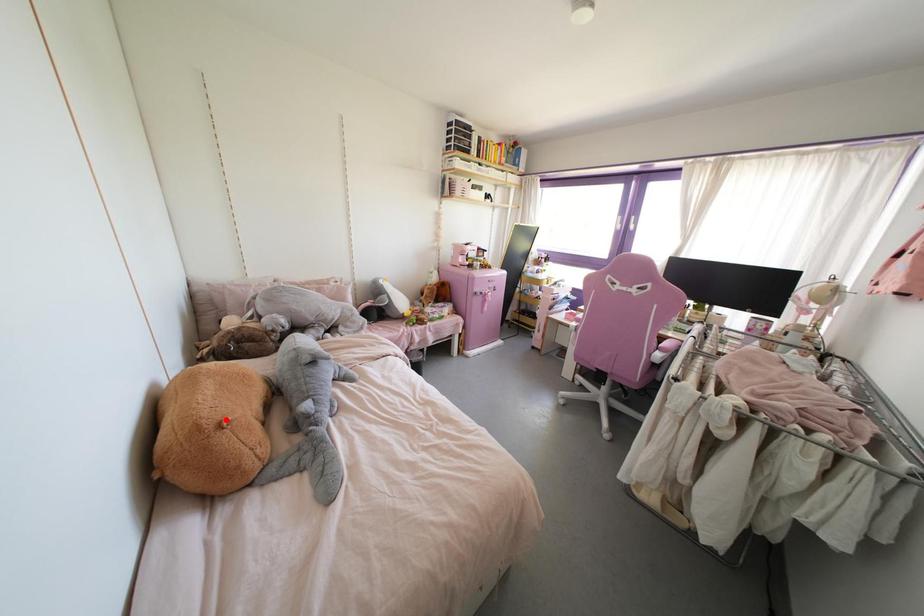
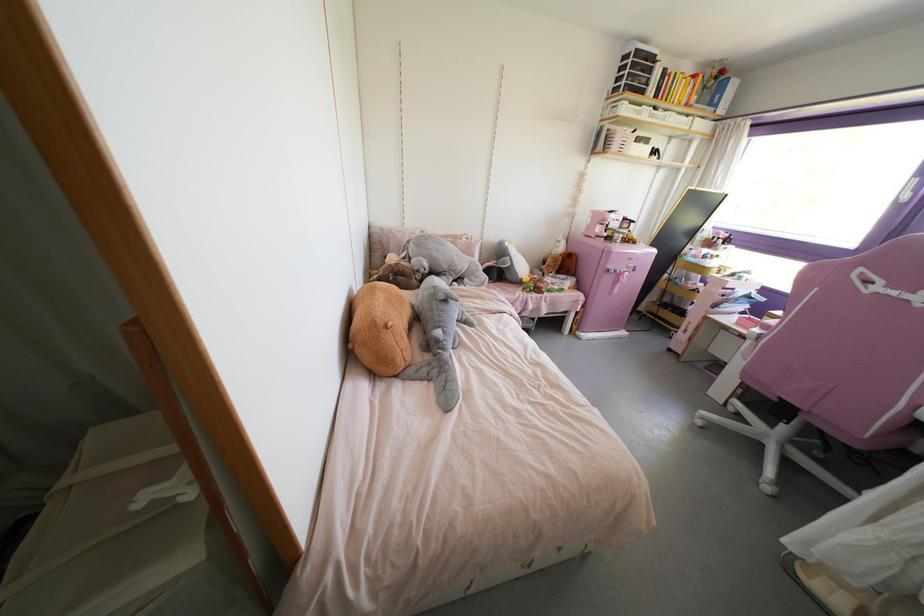
Locate, in the second image, the point that corresponds to the highlighted location in the first image.

(390, 323)